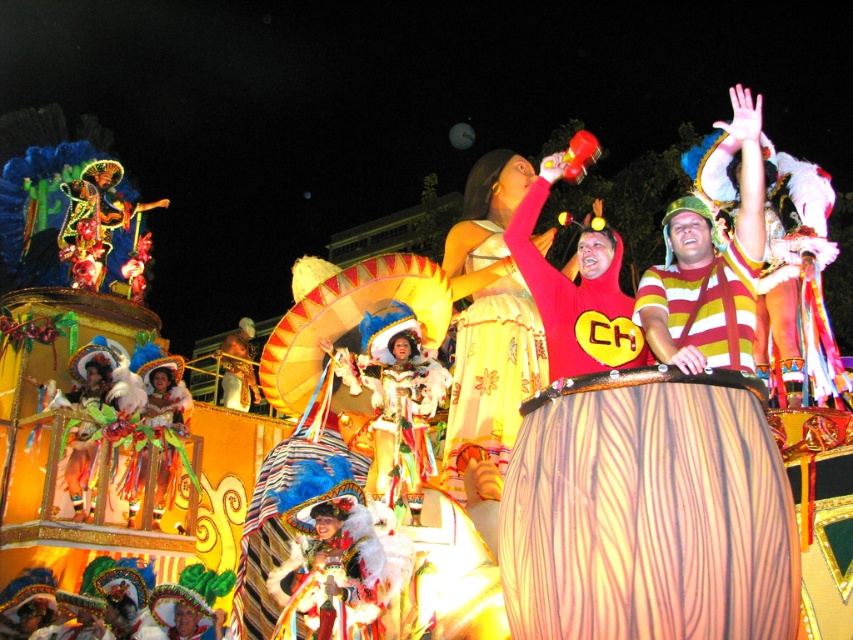
You are a photographer at the parade and want to capture both the yellow striped shirt at upper right and the yellow fabric sombrero at center in a single frame. Which object should you focus on first to ensure both are in the shot?

The yellow striped shirt at upper right is wider than the yellow fabric sombrero at center, so focusing on the wider object first will help ensure both fit in the frame.

You are a photographer standing at the center of the parade scene. You want to take a photo that includes both the yellow striped shirt at upper right and the yellow fabric sombrero at center. Given that your camera has a maximum focus range of 150 feet, will you be able to capture both subjects in focus?

The yellow striped shirt at upper right is 187.33 feet away from the yellow fabric sombrero at center. Since the distance between them exceeds the camera maximum focus range of 150 feet, you cannot capture both subjects in focus.